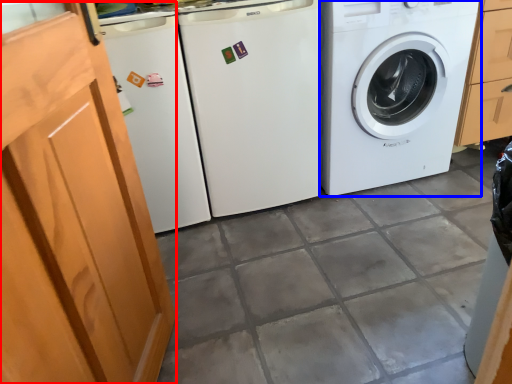
Question: Which object is further to the camera taking this photo, screen door (highlighted by a red box) or washing machine (highlighted by a blue box)?

Choices:
 (A) screen door
 (B) washing machine

Answer: (B)